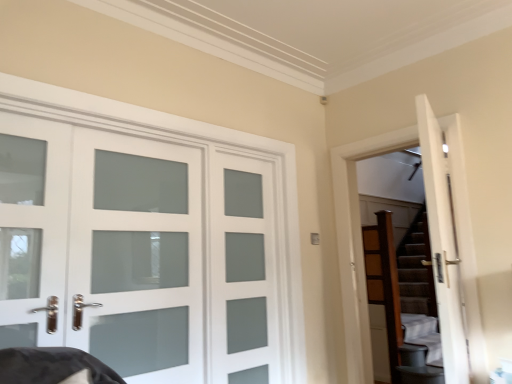
What do you see at coordinates (242, 271) in the screenshot? The width and height of the screenshot is (512, 384). I see `satin glass door at center, which is counted as the 1th screen door, starting from the right` at bounding box center [242, 271].

Measure the distance between brown textured stairs at right and camera.

brown textured stairs at right is 3.03 meters away from camera.

You are a GUI agent. You are given a task and a screenshot of the screen. Output one action in this format:
    pyautogui.click(x=<x>, y=<y>)
    Task: Click on the wooden dresser at right
    The height and width of the screenshot is (384, 512).
    Given the screenshot: What is the action you would take?
    pyautogui.click(x=384, y=282)

In terms of width, does brown textured stairs at right look wider or thinner when compared to wooden dresser at right?

brown textured stairs at right is wider than wooden dresser at right.

Is brown textured stairs at right spatially inside wooden dresser at right, or outside of it?

brown textured stairs at right cannot be found inside wooden dresser at right.

Between brown textured stairs at right and wooden dresser at right, which one appears on the left side from the viewer's perspective?

From the viewer's perspective, brown textured stairs at right appears more on the left side.

Is brown textured stairs at right looking in the opposite direction of wooden dresser at right?

Yes, wooden dresser at right is at the back of brown textured stairs at right.

Which object is closer to the camera taking this photo, white frosted glass door at left, the second screen door when ordered from right to left, or brown textured stairs at right?

white frosted glass door at left, the second screen door when ordered from right to left.

Is white frosted glass door at left, marked as the 1th screen door in a left-to-right arrangement, not within brown textured stairs at right?

Indeed, white frosted glass door at left, marked as the 1th screen door in a left-to-right arrangement, is completely outside brown textured stairs at right.

Is white frosted glass door at left, the second screen door when ordered from right to left, facing away from brown textured stairs at right?

That's not correct — white frosted glass door at left, the second screen door when ordered from right to left, is not looking away from brown textured stairs at right.

Could you measure the distance between white frosted glass door at left, marked as the 1th screen door in a left-to-right arrangement, and brown textured stairs at right?

white frosted glass door at left, marked as the 1th screen door in a left-to-right arrangement, and brown textured stairs at right are 1.56 meters apart.

Between brown textured stairs at right and satin glass door at center, which is counted as the second screen door, starting from the left, which one has smaller width?

With smaller width is satin glass door at center, which is counted as the second screen door, starting from the left.

From the image's perspective, is brown textured stairs at right on top of satin glass door at center, which is counted as the 1th screen door, starting from the right?

Yes, from the image's perspective, brown textured stairs at right is over satin glass door at center, which is counted as the 1th screen door, starting from the right.

From their relative heights in the image, would you say brown textured stairs at right is taller or shorter than satin glass door at center, which is counted as the second screen door, starting from the left?

In the image, brown textured stairs at right appears to be taller than satin glass door at center, which is counted as the second screen door, starting from the left.

Considering their positions, is brown textured stairs at right located in front of or behind satin glass door at center, which is counted as the 1th screen door, starting from the right?

brown textured stairs at right is in front of satin glass door at center, which is counted as the 1th screen door, starting from the right.

Is white frosted glass door at left at the back of wooden dresser at right?

No, wooden dresser at right's orientation is not away from white frosted glass door at left.

Is wooden dresser at right positioned behind white frosted glass door at left?

Yes, the depth of wooden dresser at right is greater than that of white frosted glass door at left.

Based on the photo, would you say white frosted glass door at left is part of wooden dresser at right's contents?

Definitely not — white frosted glass door at left is not inside wooden dresser at right.

Based on the photo, who is taller, white frosted glass door at left, marked as the 1th screen door in a left-to-right arrangement, or wooden dresser at right?

With more height is wooden dresser at right.

Is white frosted glass door at left, the second screen door when ordered from right to left, aimed at wooden dresser at right?

No, white frosted glass door at left, the second screen door when ordered from right to left, does not turn towards wooden dresser at right.

Considering the positions of objects white frosted glass door at left, the second screen door when ordered from right to left, and wooden dresser at right in the image provided, who is in front, white frosted glass door at left, the second screen door when ordered from right to left, or wooden dresser at right?

Positioned in front is white frosted glass door at left, the second screen door when ordered from right to left.

From the picture: Is satin glass door at center, which is counted as the second screen door, starting from the left, far away from white frosted glass door at left, the second screen door when ordered from right to left?

satin glass door at center, which is counted as the second screen door, starting from the left, is near white frosted glass door at left, the second screen door when ordered from right to left, not far away.

Considering the sizes of objects satin glass door at center, which is counted as the 1th screen door, starting from the right, and white frosted glass door at left, the second screen door when ordered from right to left, in the image provided, who is bigger, satin glass door at center, which is counted as the 1th screen door, starting from the right, or white frosted glass door at left, the second screen door when ordered from right to left,?

Bigger between the two is white frosted glass door at left, the second screen door when ordered from right to left.

Based on the photo, can you confirm if satin glass door at center, which is counted as the second screen door, starting from the left, is shorter than white frosted glass door at left, marked as the 1th screen door in a left-to-right arrangement?

No.

From the image's perspective, is satin glass door at center, which is counted as the second screen door, starting from the left, located above or below white frosted glass door at left, the second screen door when ordered from right to left?

Clearly, from the image's perspective, satin glass door at center, which is counted as the second screen door, starting from the left, is below white frosted glass door at left, the second screen door when ordered from right to left.

Is white frosted glass door at left in contact with white frosted glass door at left, marked as the 1th screen door in a left-to-right arrangement?

Absolutely, white frosted glass door at left is next to and touching white frosted glass door at left, marked as the 1th screen door in a left-to-right arrangement.

In terms of height, does white frosted glass door at left look taller or shorter compared to white frosted glass door at left, the second screen door when ordered from right to left?

Clearly, white frosted glass door at left is taller compared to white frosted glass door at left, the second screen door when ordered from right to left.

Based on the photo, from the image's perspective, which one is positioned higher, white frosted glass door at left or white frosted glass door at left, the second screen door when ordered from right to left?

white frosted glass door at left, the second screen door when ordered from right to left, from the image's perspective.

Locate an element on the screen. door below the white frosted glass door at left, marked as the 1th screen door in a left-to-right arrangement (from a real-world perspective) is located at coordinates (140, 252).

Image resolution: width=512 pixels, height=384 pixels. I want to click on dresser behind the brown textured stairs at right, so [384, 282].

This screenshot has width=512, height=384. Find the location of `garage door on the right of white frosted glass door at left, the second screen door when ordered from right to left`. garage door on the right of white frosted glass door at left, the second screen door when ordered from right to left is located at coordinates (358, 243).

In the scene shown: Which object lies nearer to the anchor point brown textured stairs at right, white frosted glass door at left or wooden dresser at right?

Among the two, wooden dresser at right is located nearer to brown textured stairs at right.

Estimate the real-world distances between objects in this image. Which object is closer to white frosted glass door at left, satin glass door at center, which is counted as the 1th screen door, starting from the right, or brown textured stairs at right?

satin glass door at center, which is counted as the 1th screen door, starting from the right.

Based on their spatial positions, is white frosted glass door at left, the second screen door when ordered from right to left, or white frosted glass door at left further from satin glass door at center, which is counted as the second screen door, starting from the left?

→ Based on the image, white frosted glass door at left, the second screen door when ordered from right to left, appears to be further to satin glass door at center, which is counted as the second screen door, starting from the left.

From the image, which object appears to be farther from white frosted glass door at left, marked as the 1th screen door in a left-to-right arrangement, satin glass door at center, which is counted as the second screen door, starting from the left, or wooden dresser at right?

wooden dresser at right is further to white frosted glass door at left, marked as the 1th screen door in a left-to-right arrangement.

Estimate the real-world distances between objects in this image. Which object is closer to wooden dresser at right, white frosted glass door at left or white frosted glass door at left, marked as the 1th screen door in a left-to-right arrangement?

white frosted glass door at left.

When comparing their distances from white frosted glass door at left, the second screen door when ordered from right to left, does wooden dresser at right or satin glass door at center, which is counted as the 1th screen door, starting from the right, seem closer?

Based on the image, satin glass door at center, which is counted as the 1th screen door, starting from the right, appears to be nearer to white frosted glass door at left, the second screen door when ordered from right to left.

Looking at the image, which one is located closer to white frosted glass door at left, satin glass door at center, which is counted as the second screen door, starting from the left, or wooden dresser at right?

satin glass door at center, which is counted as the second screen door, starting from the left, lies closer to white frosted glass door at left than the other object.

Looking at the image, which one is located closer to brown textured stairs at right, wooden dresser at right or white frosted glass door at left, marked as the 1th screen door in a left-to-right arrangement?

wooden dresser at right is positioned closer to the anchor brown textured stairs at right.

I want to click on door situated between white frosted glass door at left, marked as the 1th screen door in a left-to-right arrangement, and brown textured stairs at right from left to right, so coord(140,252).

Identify the location of screen door positioned between white frosted glass door at left, marked as the 1th screen door in a left-to-right arrangement, and wooden dresser at right from near to far. The image size is (512, 384). coord(242,271).

The width and height of the screenshot is (512, 384). I want to click on garage door positioned between white frosted glass door at left, marked as the 1th screen door in a left-to-right arrangement, and wooden dresser at right from near to far, so click(358, 243).

Identify the location of screen door between brown textured stairs at right and wooden dresser at right in the front-back direction. The height and width of the screenshot is (384, 512). (242, 271).